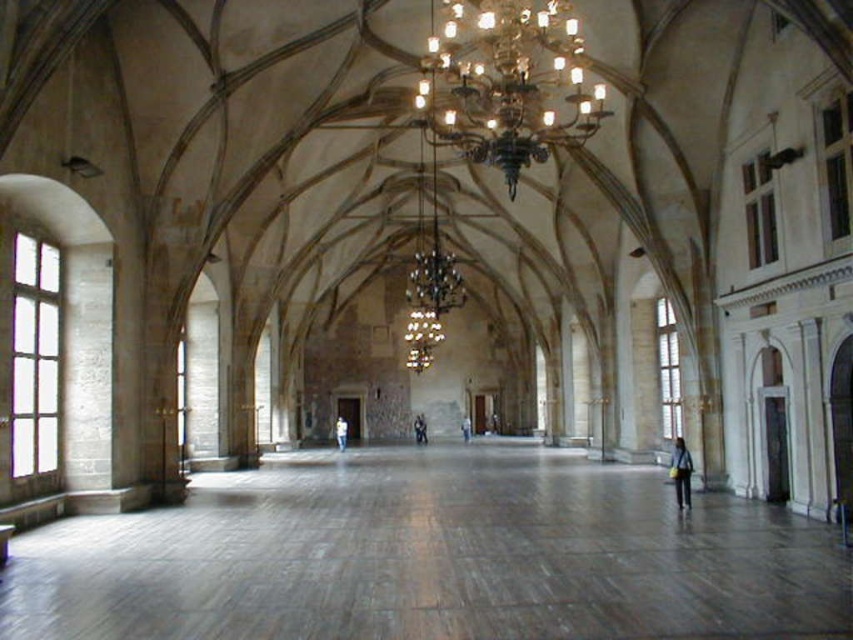
Question: Can you confirm if light blue jeans at center is positioned to the right of denim pants at center?

Choices:
 (A) no
 (B) yes

Answer: (A)

Question: Among these points, which one is nearest to the camera?

Choices:
 (A) (682, 448)
 (B) (421, 438)
 (C) (339, 449)

Answer: (A)

Question: Which of the following is the closest to the observer?

Choices:
 (A) (563, 120)
 (B) (467, 419)

Answer: (A)

Question: Which is farther from the gold metallic chandelier at upper center?

Choices:
 (A) denim pants at center
 (B) light blue denim jacket at lower right
 (C) dark blue jeans at center

Answer: (A)

Question: Is gold metallic chandelier at upper center closer to camera compared to denim pants at center?

Choices:
 (A) yes
 (B) no

Answer: (A)

Question: From the image, what is the correct spatial relationship of gold metallic chandelier at upper center in relation to dark blue jeans at center?

Choices:
 (A) right
 (B) left

Answer: (A)